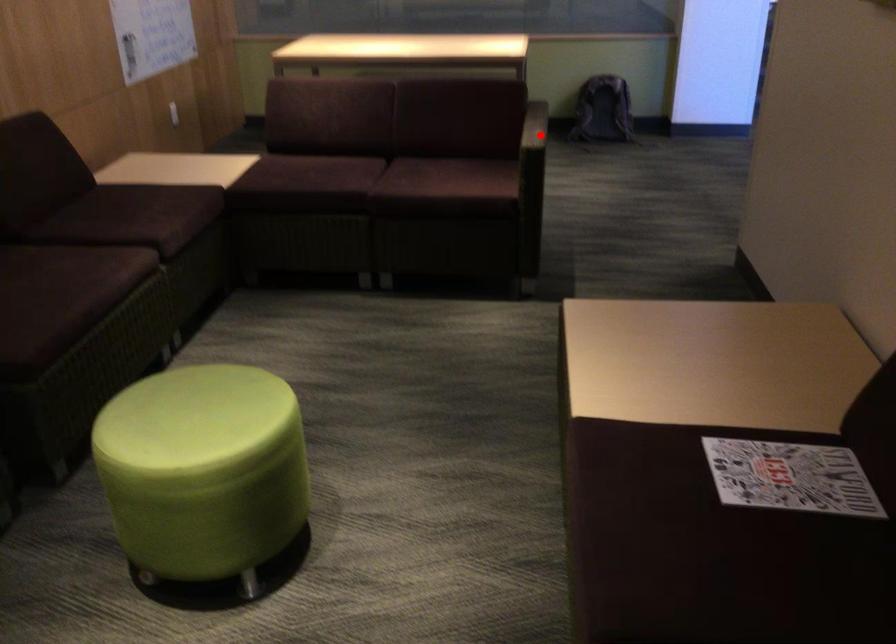
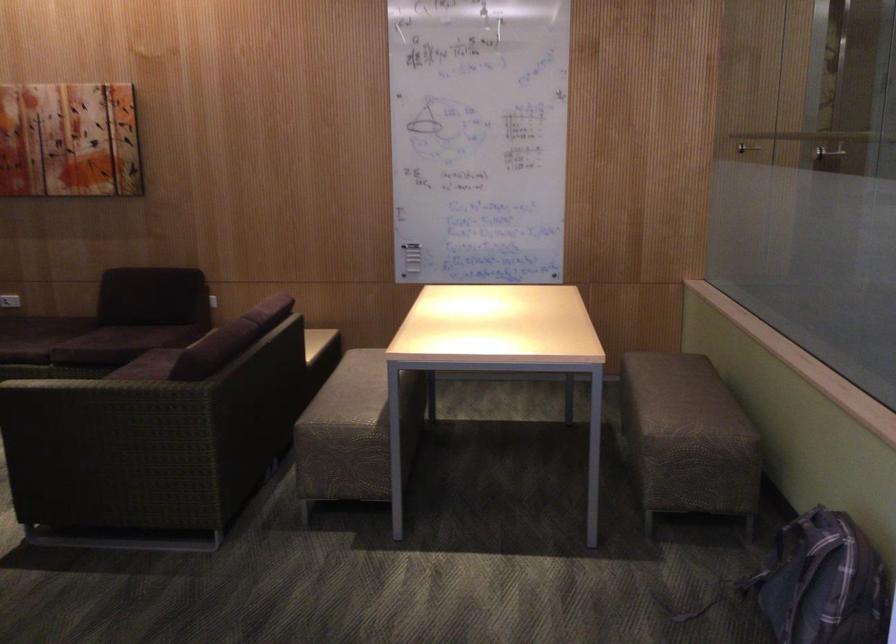
Find the pixel in the second image that matches the highlighted location in the first image.

(96, 382)